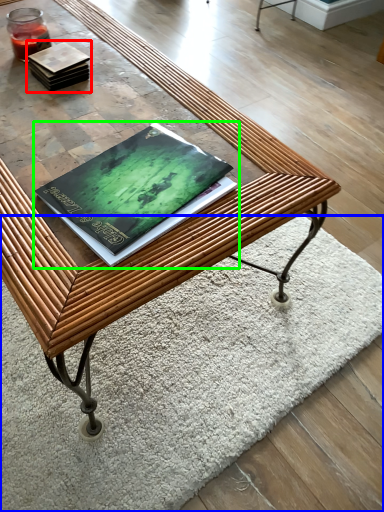
Question: Which is nearer to the book (highlighted by a red box)? mat (highlighted by a blue box) or book (highlighted by a green box).

Choices:
 (A) mat
 (B) book

Answer: (B)